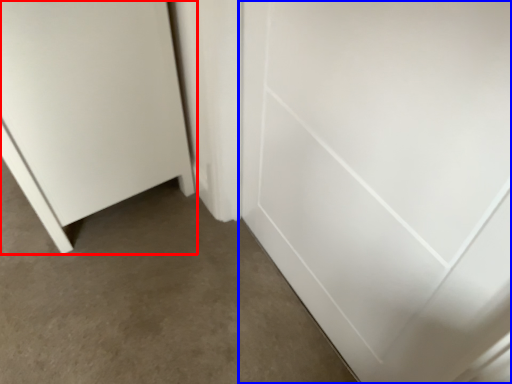
Question: Which of the following is the closest to the observer, door (highlighted by a red box) or door (highlighted by a blue box)?

Choices:
 (A) door
 (B) door

Answer: (B)